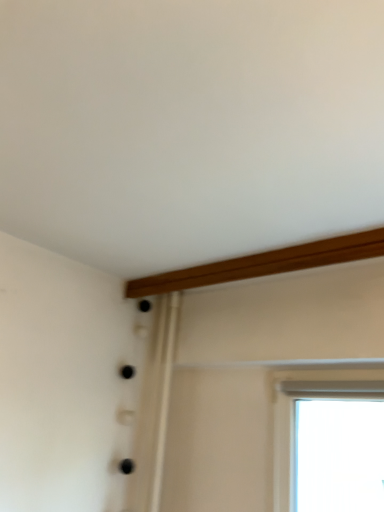
Where is `wooden beam at upper center`? wooden beam at upper center is located at coordinates (263, 264).

This screenshot has height=512, width=384. Describe the element at coordinates (263, 264) in the screenshot. I see `wooden beam at upper center` at that location.

This screenshot has width=384, height=512. In order to click on wooden beam at upper center in this screenshot , I will do `click(263, 264)`.